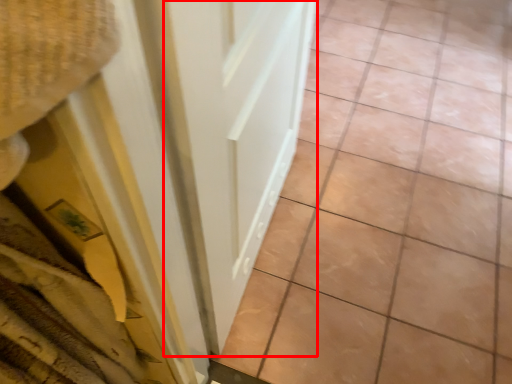
Question: Where is door (annotated by the red box) located in relation to ceramic tile in the image?

Choices:
 (A) left
 (B) right

Answer: (A)